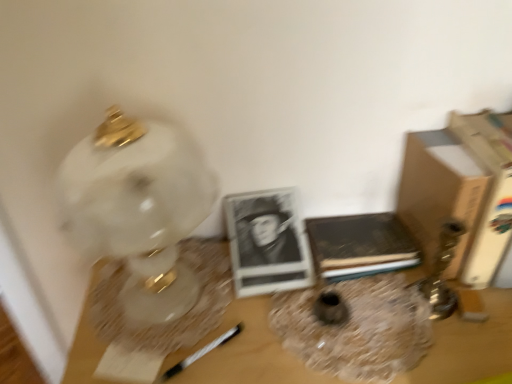
Where is `vacant area that is in front of matte glass vase at center, which ranks as the second vase in right-to-left order`? Image resolution: width=512 pixels, height=384 pixels. vacant area that is in front of matte glass vase at center, which ranks as the second vase in right-to-left order is located at coordinates (340, 358).